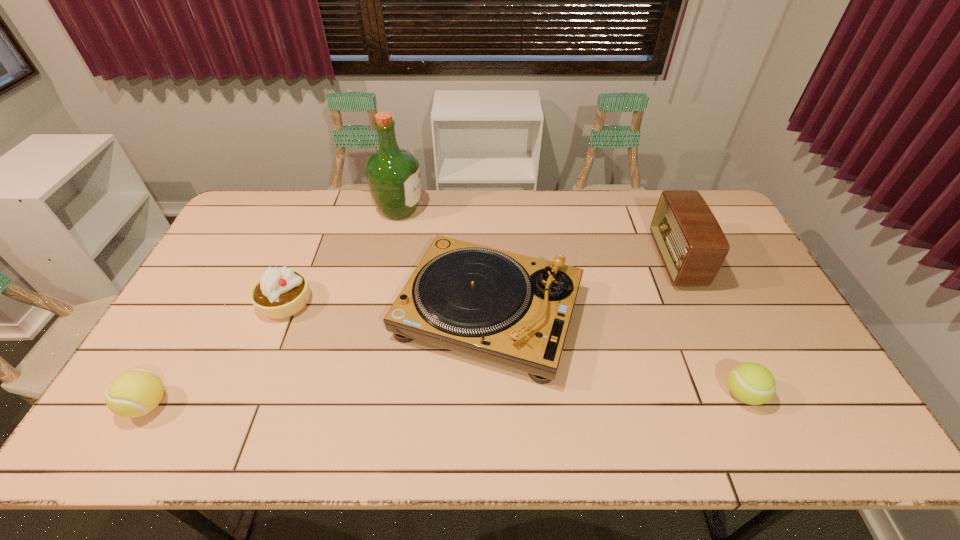
Identify the location of free space located on the front-facing side of the fifth shortest object. This screenshot has height=540, width=960. (550, 260).

The image size is (960, 540). I want to click on free space located on the right of the fourth shortest object, so click(688, 313).

Where is `vacant space located 0.230m on the back of the whipped cream`? Image resolution: width=960 pixels, height=540 pixels. vacant space located 0.230m on the back of the whipped cream is located at coordinates (313, 234).

Image resolution: width=960 pixels, height=540 pixels. I want to click on blank space located 0.320m on the back of the leftmost object, so click(213, 291).

Locate an element on the screen. The height and width of the screenshot is (540, 960). vacant space situated on the back of the right tennis ball is located at coordinates (714, 332).

Identify the location of liquor that is at the far edge. (393, 175).

Image resolution: width=960 pixels, height=540 pixels. I want to click on radio receiver positioned at the far edge, so click(x=690, y=241).

Locate an element on the screen. object situated at the near edge is located at coordinates (134, 393).

The width and height of the screenshot is (960, 540). I want to click on object located at the left edge, so click(x=134, y=393).

This screenshot has height=540, width=960. I want to click on object located at the right edge, so click(x=751, y=383).